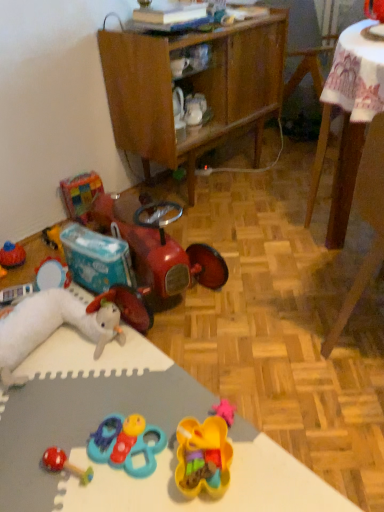
What are the coordinates of `empty space that is in between translucent plastic container at center, the fifth toy viewed from the left, and teal plastic toy at center, which appears as the fourth toy when viewed from the left` in the screenshot? It's located at (158, 445).